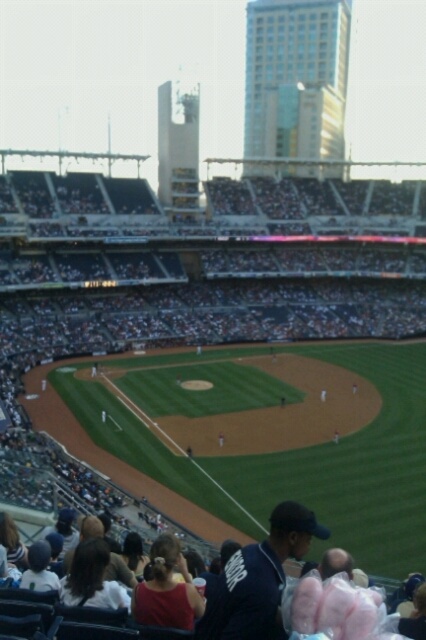
Question: Which object is farther from the camera taking this photo?

Choices:
 (A) dark blue jersey at lower center
 (B) dark blue jersey at center
 (C) matte red shirt at lower center

Answer: (B)

Question: Estimate the real-world distances between objects in this image. Which object is farther from the matte red shirt at lower center?

Choices:
 (A) dark blue jersey at center
 (B) dark blue jersey at lower center

Answer: (A)

Question: Which point is farther from the camera taking this photo?

Choices:
 (A) (36, 230)
 (B) (264, 625)

Answer: (A)

Question: Can you confirm if dark blue jersey at lower center is smaller than matte red shirt at lower center?

Choices:
 (A) no
 (B) yes

Answer: (A)

Question: Where is dark blue jersey at center located in relation to matte red shirt at lower center in the image?

Choices:
 (A) above
 (B) below

Answer: (A)

Question: In this image, where is dark blue jersey at lower center located relative to matte red shirt at lower center?

Choices:
 (A) right
 (B) left

Answer: (A)